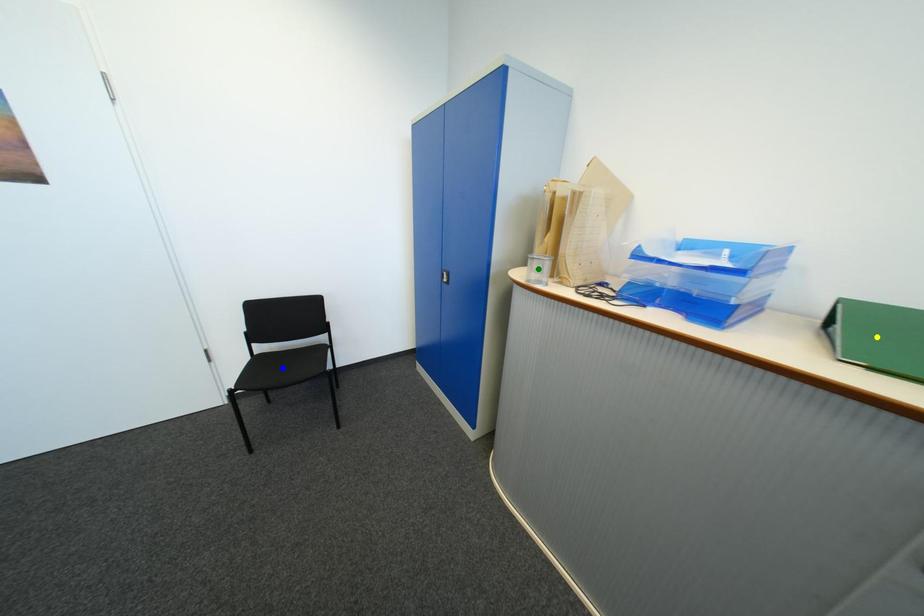
Order these from nearest to farthest:
1. green point
2. yellow point
3. blue point

yellow point, green point, blue point